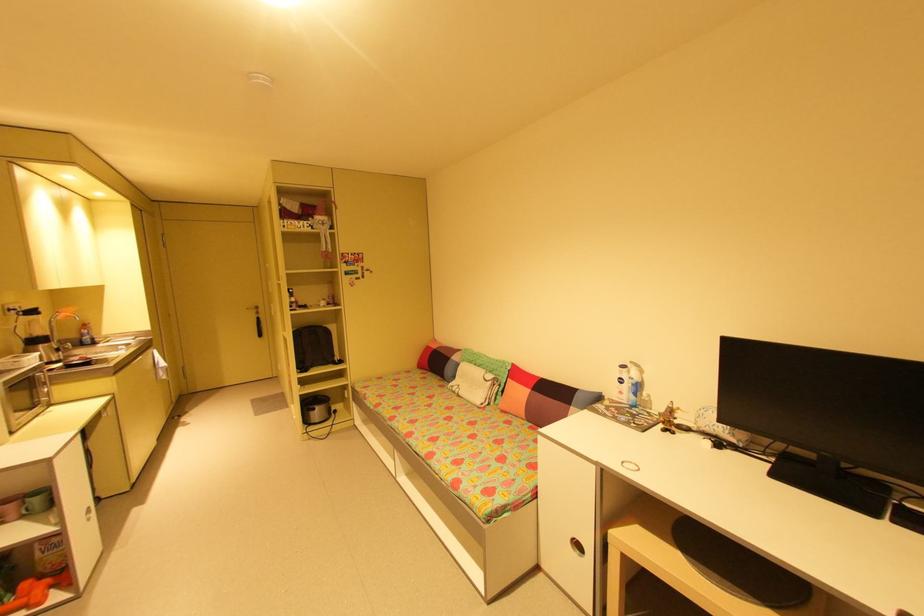
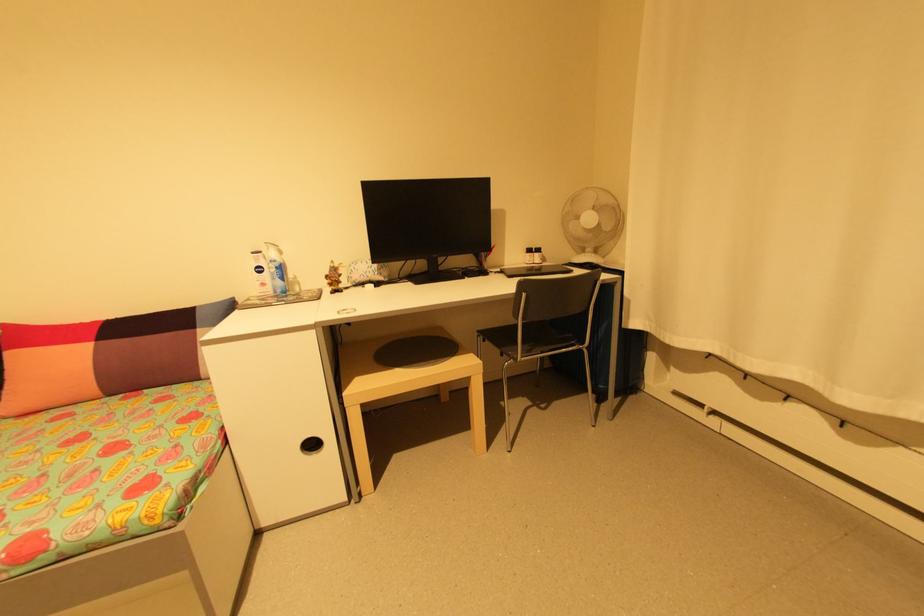
The point at (678,408) is marked in the first image. Where is the corresponding point in the second image?

(341, 265)